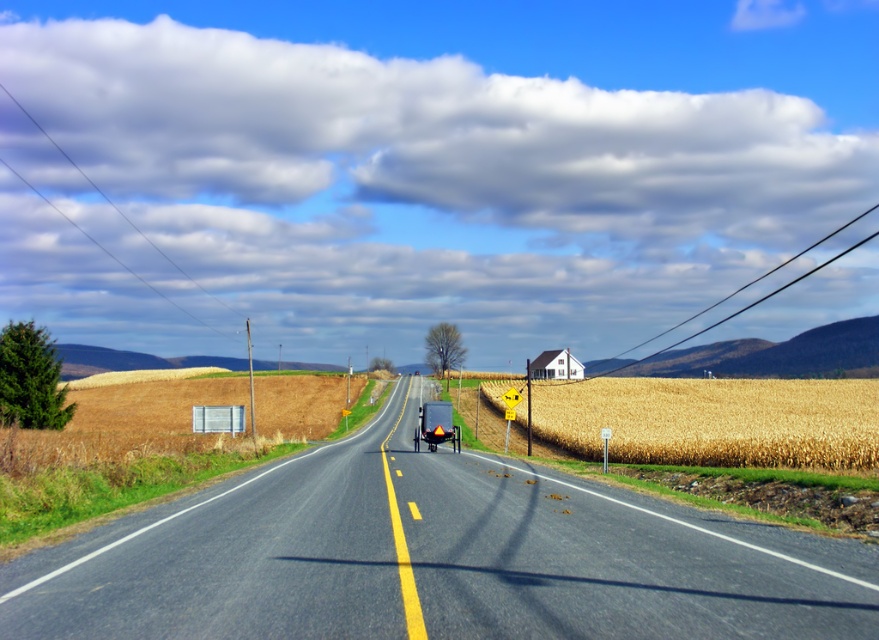
You are driving a car and see the asphalt road at center and the golden grain field at right. Which one is closer to you?

The asphalt road at center is closer to you because it is positioned over the golden grain field at right, indicating it is in front of the field.

You are standing at the origin point of the coordinate system. You want to walk to the asphalt road at center. What direction should you walk in?

Since the asphalt road at center is located at coordinate point (434, 557), you should walk towards the positive x and y direction to reach it.

You are driving a car and want to know if the golden grain field at right is taller than the asphalt road at center. Can you confirm this based on the scene?

The asphalt road at center is not as tall as golden grain field at right, so yes, the golden grain field at right is taller than the asphalt road at center.